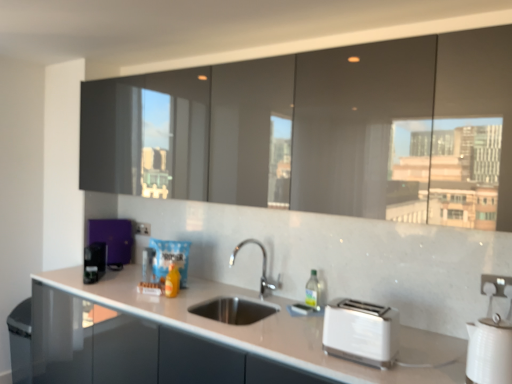
Question: Is purple matte coffee maker at left, arranged as the first appliance when viewed from the back, bigger than translucent plastic bag at center?

Choices:
 (A) no
 (B) yes

Answer: (B)

Question: From a real-world perspective, is purple matte coffee maker at left, arranged as the first appliance when viewed from the back, over translucent plastic bag at center?

Choices:
 (A) yes
 (B) no

Answer: (A)

Question: From the image's perspective, is purple matte coffee maker at left, which ranks as the 4th appliance in front-to-back order, on top of translucent plastic bag at center?

Choices:
 (A) no
 (B) yes

Answer: (B)

Question: Is purple matte coffee maker at left, which is the fourth appliance in right-to-left order, closer to the viewer compared to translucent plastic bag at center?

Choices:
 (A) yes
 (B) no

Answer: (B)

Question: From a real-world perspective, is purple matte coffee maker at left, arranged as the first appliance when viewed from the back, located beneath translucent plastic bag at center?

Choices:
 (A) yes
 (B) no

Answer: (B)

Question: Considering the relative sizes of purple matte coffee maker at left, the 1th appliance from the left, and translucent plastic bag at center in the image provided, is purple matte coffee maker at left, the 1th appliance from the left, taller than translucent plastic bag at center?

Choices:
 (A) no
 (B) yes

Answer: (B)

Question: Does metallic silver toaster at center, which is the third appliance from front to back, appear on the right side of white plastic electric outlet at lower right, positioned as the 1th electric outlet in right-to-left order?

Choices:
 (A) no
 (B) yes

Answer: (A)

Question: From a real-world perspective, is metallic silver toaster at center, placed as the 3th appliance when sorted from left to right, on top of white plastic electric outlet at lower right, the 2th electric outlet in the back-to-front sequence?

Choices:
 (A) yes
 (B) no

Answer: (B)

Question: Is metallic silver toaster at center, which is the third appliance from front to back, at the left side of white plastic electric outlet at lower right, which is the 1th electric outlet in front-to-back order?

Choices:
 (A) yes
 (B) no

Answer: (A)

Question: Considering the relative sizes of metallic silver toaster at center, placed as the 3th appliance when sorted from left to right, and white plastic electric outlet at lower right, acting as the second electric outlet starting from the top, in the image provided, is metallic silver toaster at center, placed as the 3th appliance when sorted from left to right, taller than white plastic electric outlet at lower right, acting as the second electric outlet starting from the top,?

Choices:
 (A) no
 (B) yes

Answer: (B)

Question: Considering the relative sizes of metallic silver toaster at center, placed as the 3th appliance when sorted from left to right, and white plastic electric outlet at lower right, which is the 2th electric outlet in left-to-right order, in the image provided, is metallic silver toaster at center, placed as the 3th appliance when sorted from left to right, wider than white plastic electric outlet at lower right, which is the 2th electric outlet in left-to-right order,?

Choices:
 (A) no
 (B) yes

Answer: (B)

Question: Would you say metallic silver toaster at center, placed as the 3th appliance when sorted from left to right, is outside white plastic electric outlet at lower right, positioned as the 1th electric outlet in right-to-left order?

Choices:
 (A) yes
 (B) no

Answer: (A)

Question: Considering the relative sizes of purple matte coffee maker at left, which ranks as the 4th appliance in front-to-back order, and white glossy countertop at center in the image provided, is purple matte coffee maker at left, which ranks as the 4th appliance in front-to-back order, taller than white glossy countertop at center?

Choices:
 (A) yes
 (B) no

Answer: (B)